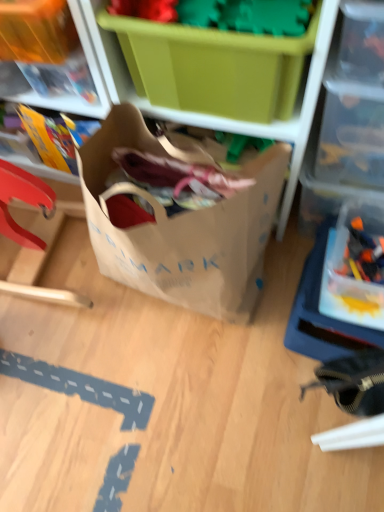
Where is `unoccupied area in front of brown paper bag at center`? The image size is (384, 512). unoccupied area in front of brown paper bag at center is located at coordinates (191, 398).